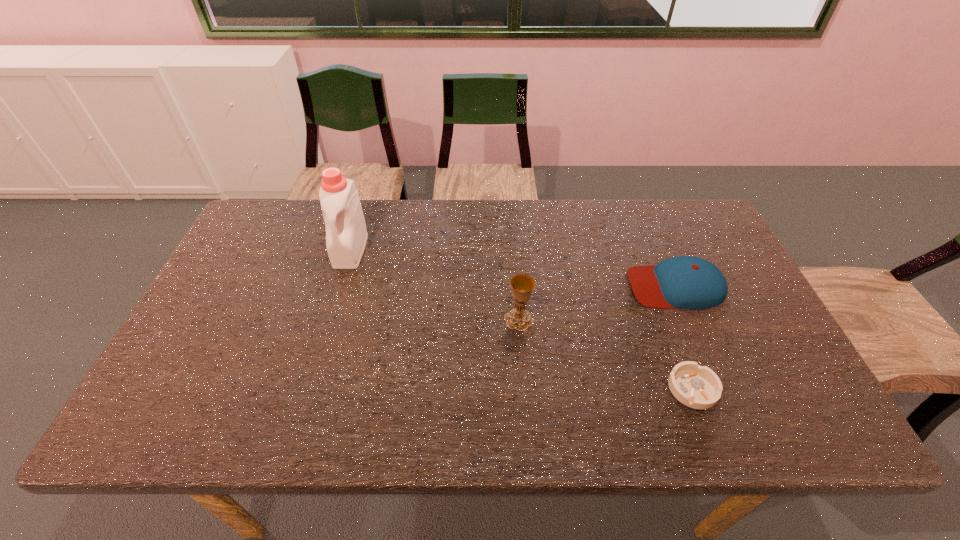
Locate an element on the screen. The width and height of the screenshot is (960, 540). free space between the third object from right to left and the detergent is located at coordinates (435, 285).

The width and height of the screenshot is (960, 540). I want to click on free area in between the third object from right to left and the tallest object, so click(x=435, y=285).

Locate an element on the screen. free space between the tallest object and the third object from right to left is located at coordinates (435, 285).

In order to click on vacant space in between the nearest object and the third object from right to left in this screenshot , I will do `click(606, 354)`.

This screenshot has height=540, width=960. What are the coordinates of `free spot between the second shortest object and the ashtray` in the screenshot? It's located at (684, 338).

Image resolution: width=960 pixels, height=540 pixels. Identify the location of free spot between the baseball cap and the detergent. (513, 268).

Identify the location of unoccupied position between the second shortest object and the nearest object. (684, 338).

Locate an element on the screen. The image size is (960, 540). free space between the chalice and the third tallest object is located at coordinates (597, 303).

In order to click on vacant space in between the second shortest object and the shortest object in this screenshot , I will do `click(684, 338)`.

Find the location of a particular element. This screenshot has width=960, height=540. the closest object to the leftmost object is located at coordinates (522, 285).